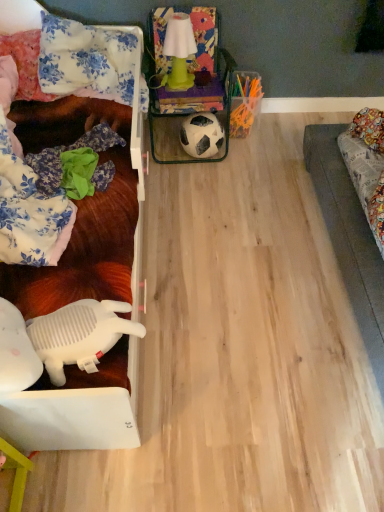
Identify the location of vacant space to the right of white matte football at center. (248, 157).